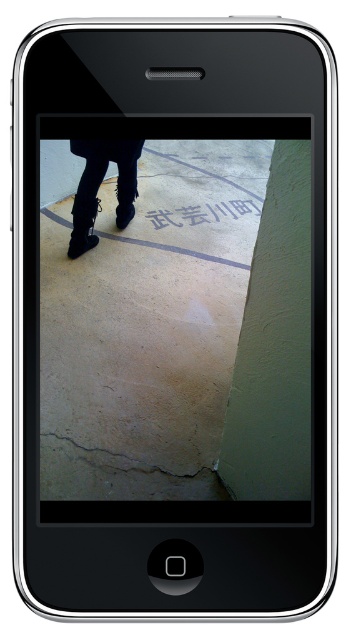
You are looking at the smartphone screen showing the photo. Which object is closer to you between the black leather boots at lower left and the brown rough concrete at lower center?

The black leather boots at lower left is closer to you than the brown rough concrete at lower center because it is further to the viewer.

You are using a smartphone from the early 2010s to take a photo. The screen shows a boot and some text. Where on the screen is the black leather boots at lower left located?

The black leather boots at lower left are located at the 2D coordinates point (x=98, y=186) on the screen.

You are holding a smartphone and want to take a closer photo of the black leather boots at lower left. The current distance is 1.85 meters. If you move 0.5 meters closer, will the boots still be in focus if the phone can focus up to 1.5 meters?

The black leather boots at lower left are currently 1.85 meters away. Moving 0.5 meters closer would bring the distance to 1.35 meters, which is within the phone camera focus range of up to 1.5 meters. Therefore, the boots will still be in focus.